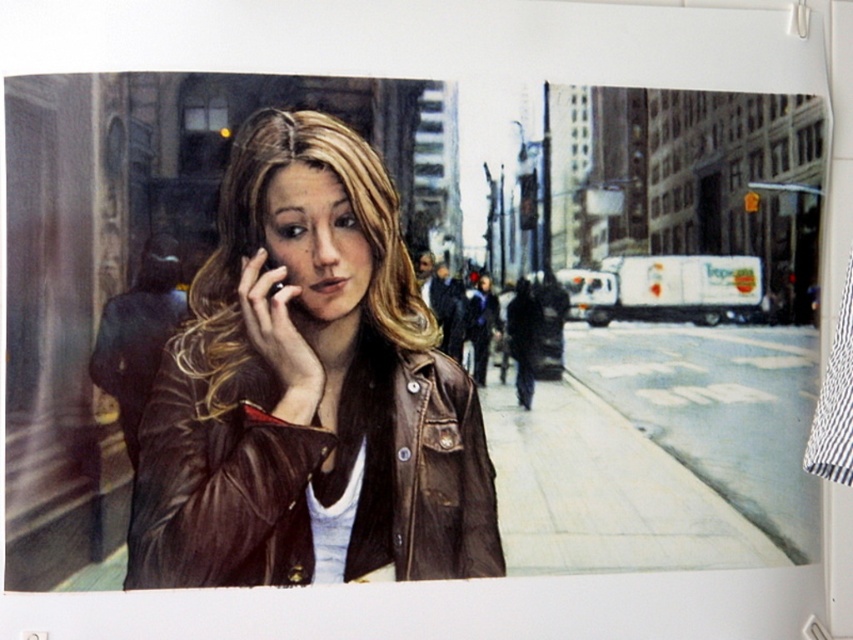
Does brown leather jacket at center have a smaller size compared to matte black phone at center?

Actually, brown leather jacket at center might be larger than matte black phone at center.

Between brown leather jacket at center and matte black phone at center, which one is positioned lower?

brown leather jacket at center is below.

Is point (193, 525) closer to viewer compared to point (270, 296)?

Yes, point (193, 525) is closer to viewer.

Locate an element on the screen. The width and height of the screenshot is (853, 640). brown leather jacket at center is located at coordinates (309, 392).